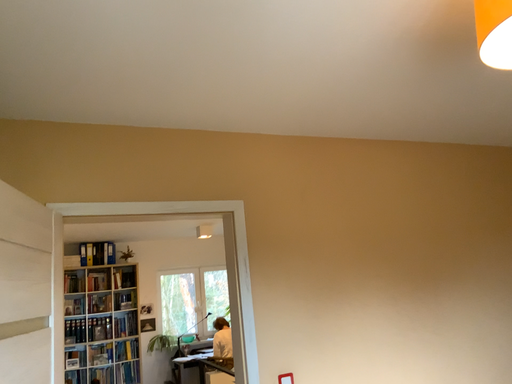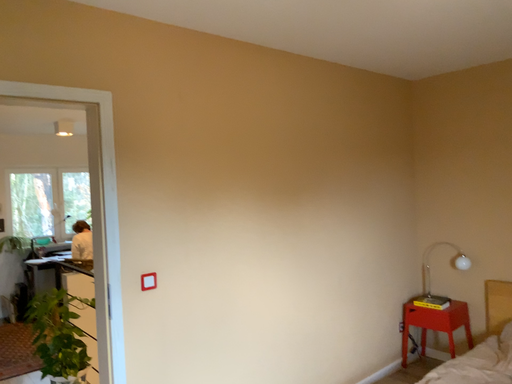
Question: How did the camera likely rotate when shooting the video?

Choices:
 (A) rotated left
 (B) rotated right

Answer: (B)